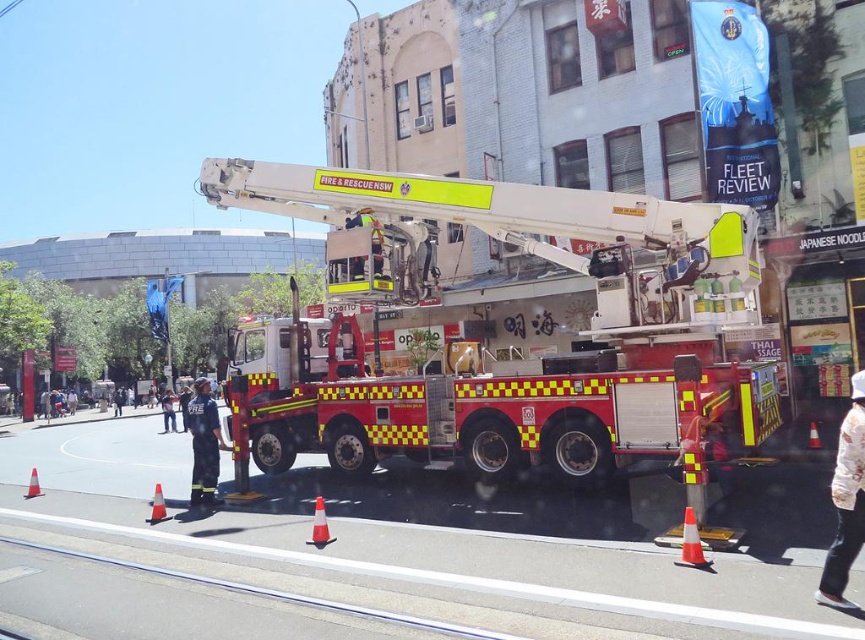
You are a firefighter assessing the scene. You notice two orange reflective traffic cones. Which one is narrower? The orange reflective traffic cone at lower left or the orange reflective traffic cone at center?

The orange reflective traffic cone at lower left is narrower than the orange reflective traffic cone at center.

You are a pedestrian standing on the sidewalk and see the firefighter uniform at center and the orange reflective traffic cone at lower right. Which object is closer to your viewpoint?

The firefighter uniform at center is closer to your viewpoint because it is positioned under the orange reflective traffic cone at lower right, meaning the cone is further away.